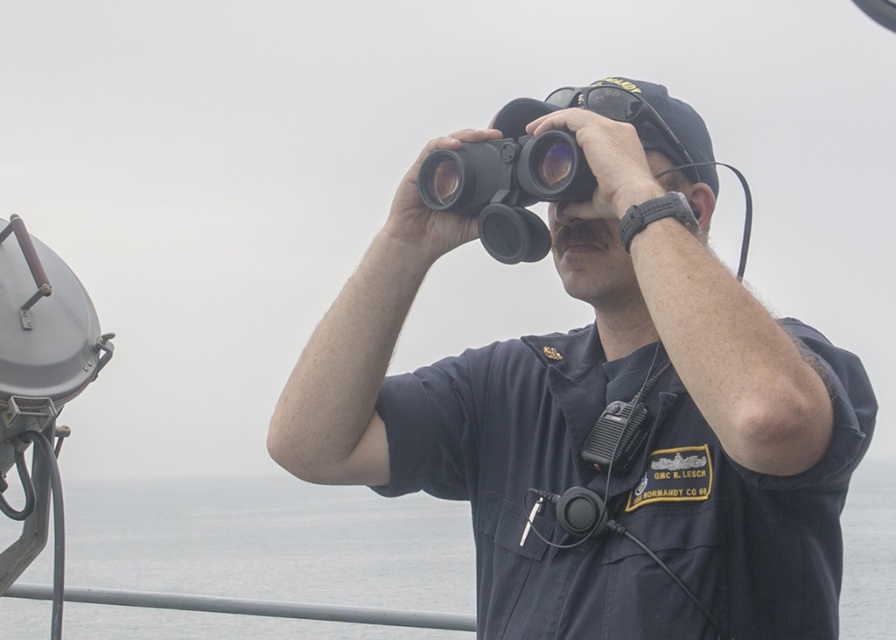
Based on the photo, does black matte binoculars at center come behind gray water at center?

No, it is in front of gray water at center.

Image resolution: width=896 pixels, height=640 pixels. Find the location of `black matte binoculars at center`. black matte binoculars at center is located at coordinates coord(602,410).

Does point (566, 208) come in front of point (293, 502)?

Yes, it is in front of point (293, 502).

Locate an element on the screen. Image resolution: width=896 pixels, height=640 pixels. black matte binoculars at center is located at coordinates [x=602, y=410].